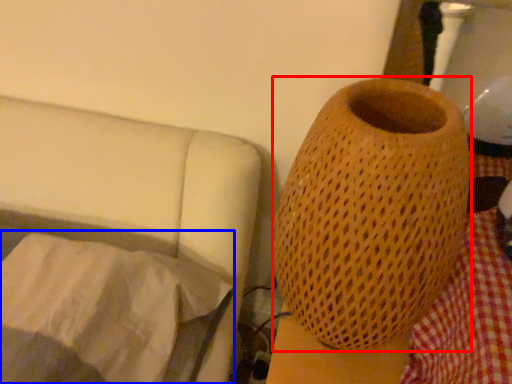
Question: Which point is closer to the camera, vase (highlighted by a red box) or sheet (highlighted by a blue box)?

Choices:
 (A) vase
 (B) sheet

Answer: (A)